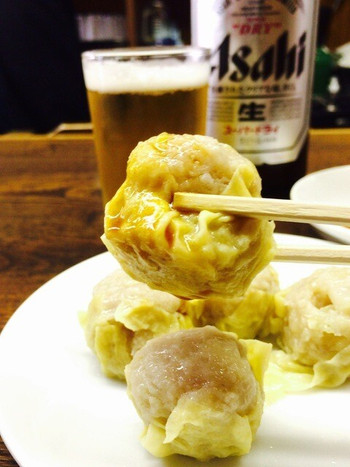
At what (x,y) coordinates should I click in order to perform the action: click on glass. Please return your answer as a coordinate pair (x, y). This screenshot has width=350, height=467. Looking at the image, I should click on (163, 62).